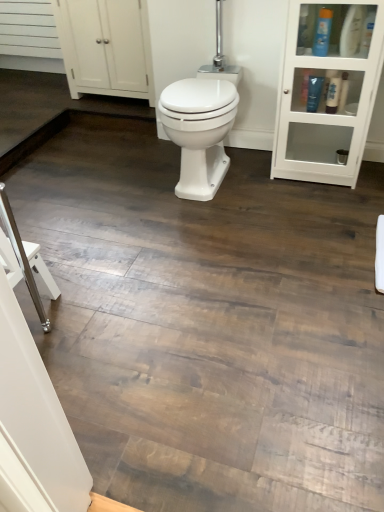
Question: In the image, is blue plastic bottle at upper right, which is counted as the second toiletry, starting from the right, positioned in front of or behind shiny black tube at upper right, arranged as the third toiletry when viewed from the right?

Choices:
 (A) front
 (B) behind

Answer: (A)

Question: Is blue plastic bottle at upper right, the second toiletry when ordered from left to right, bigger or smaller than shiny black tube at upper right, placed as the 1th toiletry when sorted from left to right?

Choices:
 (A) small
 (B) big

Answer: (B)

Question: Which object is positioned closest to the shiny black tube at upper right, arranged as the third toiletry when viewed from the right?

Choices:
 (A) white glossy bidet at center
 (B) white glass cabinet at upper right
 (C) blue plastic bottle at upper right, the second toiletry when ordered from left to right
 (D) blue plastic bottle at upper right, which appears as the third toiletry when viewed from the left
 (E) white matte cabinet at upper left

Answer: (C)

Question: Based on their relative distances, which object is farther from the white glass cabinet at upper right?

Choices:
 (A) shiny black tube at upper right, arranged as the third toiletry when viewed from the right
 (B) white glossy bidet at center
 (C) blue plastic bottle at upper right, which is counted as the second toiletry, starting from the right
 (D) blue plastic bottle at upper right, which appears as the third toiletry when viewed from the left
 (E) white matte cabinet at upper left

Answer: (E)